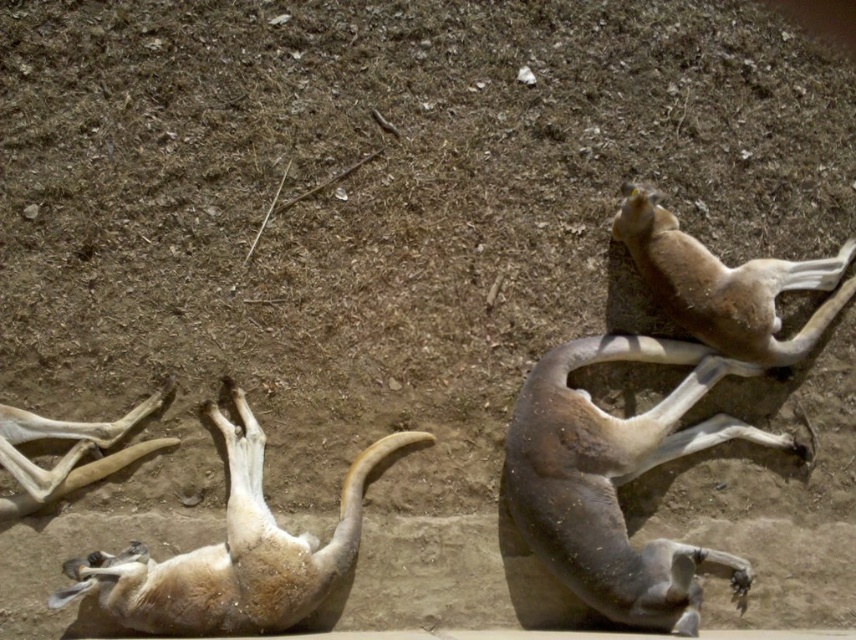
You are a wildlife photographer aiming to capture a closeup of the brown matte animal at upper right and the light brown bone at lower left in the same frame. Given that your camera can only focus on objects within a 1.5 meter distance, can you confirm if both objects are within the camera range?

The brown matte animal at upper right is larger in size than the light brown bone at lower left, but the distance between them isn not specified. Without knowing the distance between the two objects, it is impossible to determine if they are within the camera range.

You are a wildlife photographer trying to capture a photo of the brown matte animal at right and the light brown fur at lower left. Since you want to focus on the larger animal, which one should you aim your camera at?

The light brown fur at lower left is larger in width than the brown matte animal at right, so you should aim your camera at the light brown fur at lower left to focus on the larger animal.

In the scene with three kangaroos resting on dry ground, you notice two items at the lower left corner. One is the light brown fur at lower left and the other is the light brown bone at lower left. Which one is positioned more to the right?

The light brown fur at lower left is positioned to the right of the light brown bone at lower left.